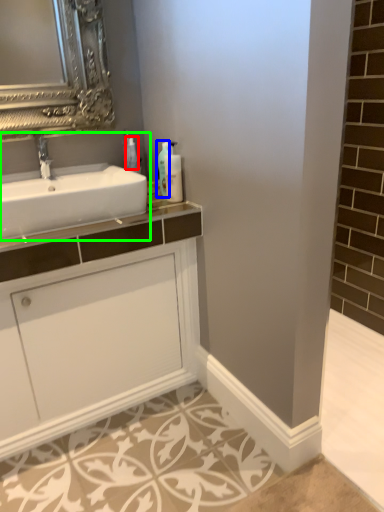
Question: Based on their relative distances, which object is nearer to toiletry (highlighted by a red box)? Choose from soap dispenser (highlighted by a blue box) and sink (highlighted by a green box).

Choices:
 (A) soap dispenser
 (B) sink

Answer: (A)